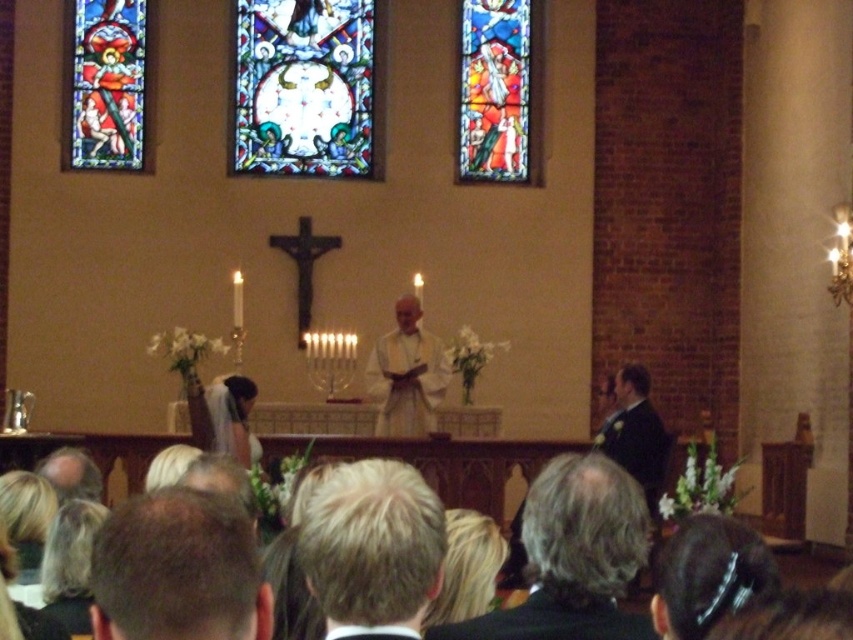
Looking at this image, you are standing in the church and see two points marked in the scene. Which of the two points, point (308, 106) or point (505, 12), is closer to you?

Point (308, 106) is closer to the viewer than point (505, 12).

You are standing in the church and want to locate the point at coordinates (305, 88). Based on the scene description, where would this point be located?

The point at coordinates (305, 88) is on the stained glass window at center, which is part of the altar area with vibrant colors and religious scenes.

You are attending the ceremony and want to know which object is taller between the matte stained glass window at upper left and the white satin veil at upper center. Can you tell me?

The matte stained glass window at upper left has a greater height compared to the white satin veil at upper center, so the matte stained glass window at upper left is taller.